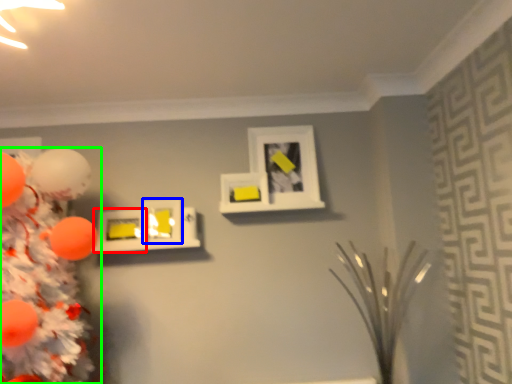
Question: Which is farther away from picture frame (highlighted by a red box)? picture frame (highlighted by a blue box) or christmas tree (highlighted by a green box)?

Choices:
 (A) picture frame
 (B) christmas tree

Answer: (B)